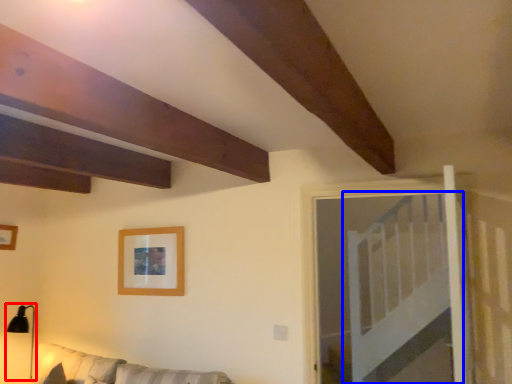
Question: Which object is further to the camera taking this photo, lamp (highlighted by a red box) or bed (highlighted by a blue box)?

Choices:
 (A) lamp
 (B) bed

Answer: (A)